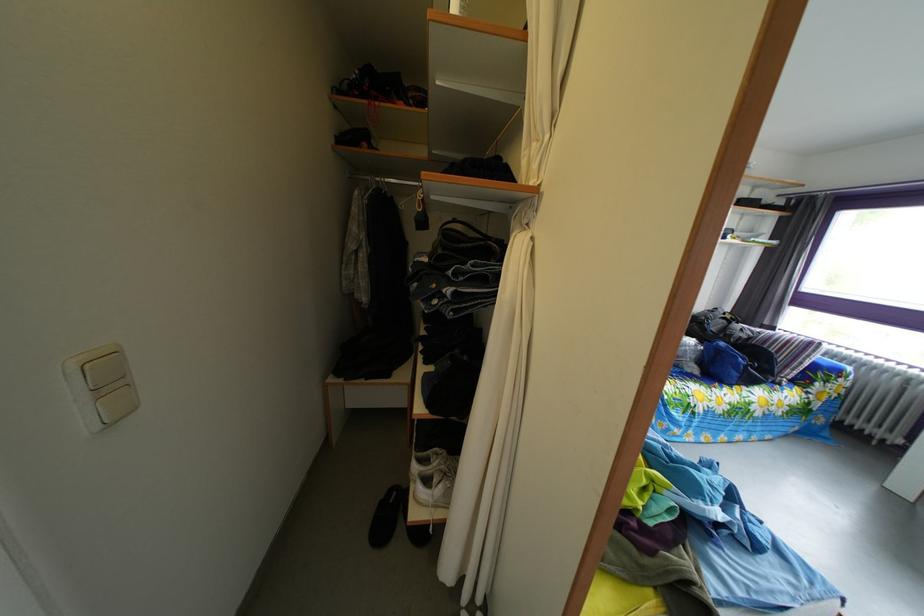
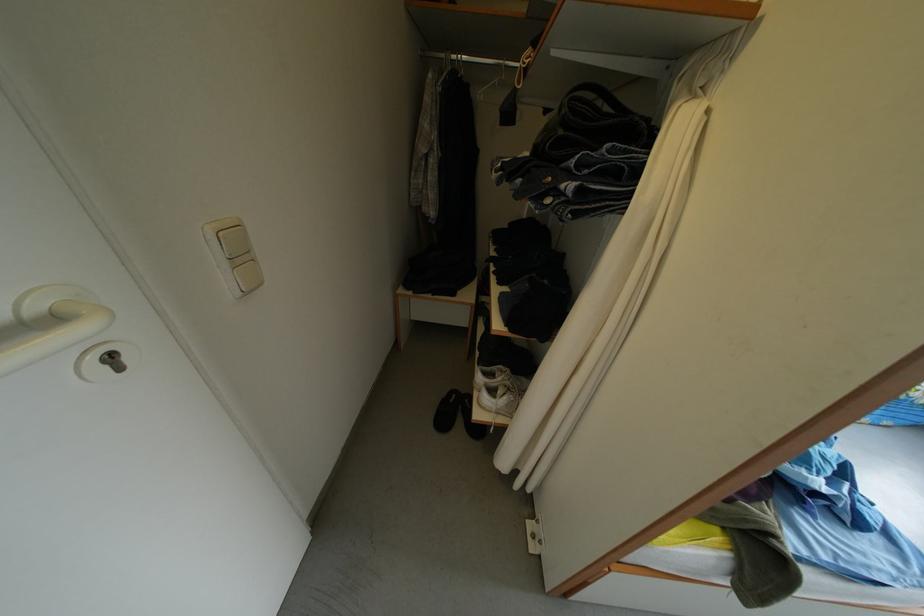
In the second image, find the point that corresponds to pixel 505 302 in the first image.

(639, 204)